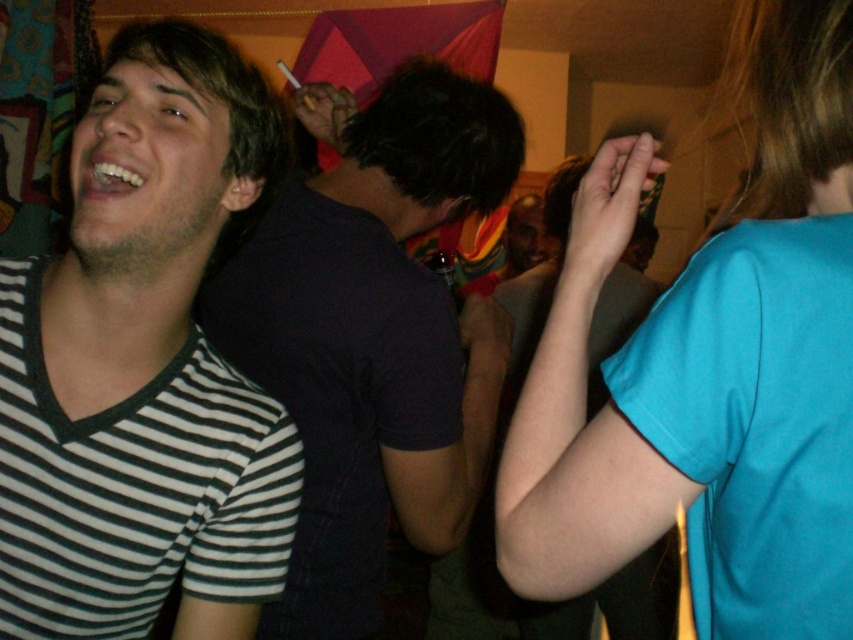
Question: In this image, where is blue fabric shirt at upper right located relative to black striped shirt at left?

Choices:
 (A) below
 (B) above

Answer: (B)

Question: Estimate the real-world distances between objects in this image. Which object is closer to the black striped shirt at left?

Choices:
 (A) striped cotton shirt at left
 (B) blue fabric shirt at upper right
 (C) matte black shirt at center
 (D) rainbow striped shirt at center

Answer: (B)

Question: Does black striped shirt at left appear on the left side of matte black shirt at center?

Choices:
 (A) yes
 (B) no

Answer: (A)

Question: Which of the following is the farthest from the observer?

Choices:
 (A) (416, 499)
 (B) (231, 122)

Answer: (A)

Question: Which is nearer to the blue fabric shirt at upper right?

Choices:
 (A) striped cotton shirt at left
 (B) rainbow striped shirt at center

Answer: (A)

Question: Does blue fabric shirt at upper right have a greater width compared to rainbow striped shirt at center?

Choices:
 (A) no
 (B) yes

Answer: (B)